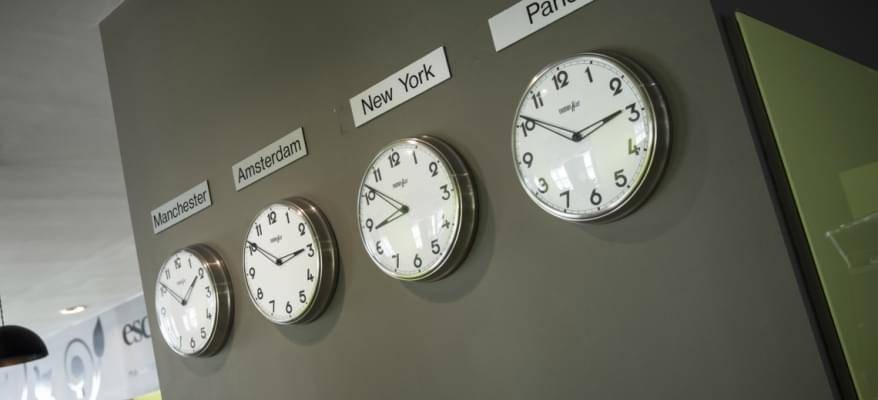
I want to click on light, so click(x=19, y=337).